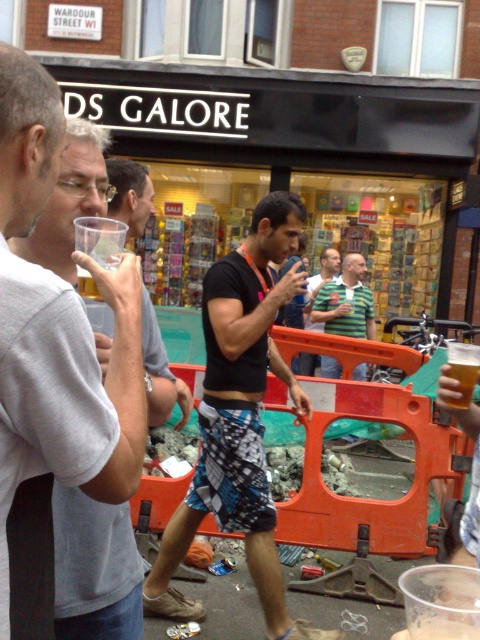
Does white matte cup at upper left lie in front of translucent plastic cup at center?

Yes, white matte cup at upper left is closer to the viewer.

Which is more to the right, white matte cup at upper left or translucent plastic cup at center?

From the viewer's perspective, translucent plastic cup at center appears more on the right side.

Where is `white matte cup at upper left`? This screenshot has width=480, height=640. white matte cup at upper left is located at coordinates [57, 330].

I want to click on white matte cup at upper left, so click(57, 330).

Can you confirm if black matte shirt at center is taller than clear plastic cup at center?

Yes, black matte shirt at center is taller than clear plastic cup at center.

Which is in front, point (184, 515) or point (420, 624)?

Point (420, 624)

Locate an element on the screen. This screenshot has height=640, width=480. black matte shirt at center is located at coordinates (239, 419).

This screenshot has height=640, width=480. Find the location of `black matte shirt at center`. black matte shirt at center is located at coordinates 239,419.

Does white matte cup at upper left have a lesser height compared to black matte shirt at center?

Yes.

Between point (75, 332) and point (204, 301), which one is positioned behind?

Point (204, 301)

Where is `white matte cup at upper left`? The image size is (480, 640). white matte cup at upper left is located at coordinates (57, 330).